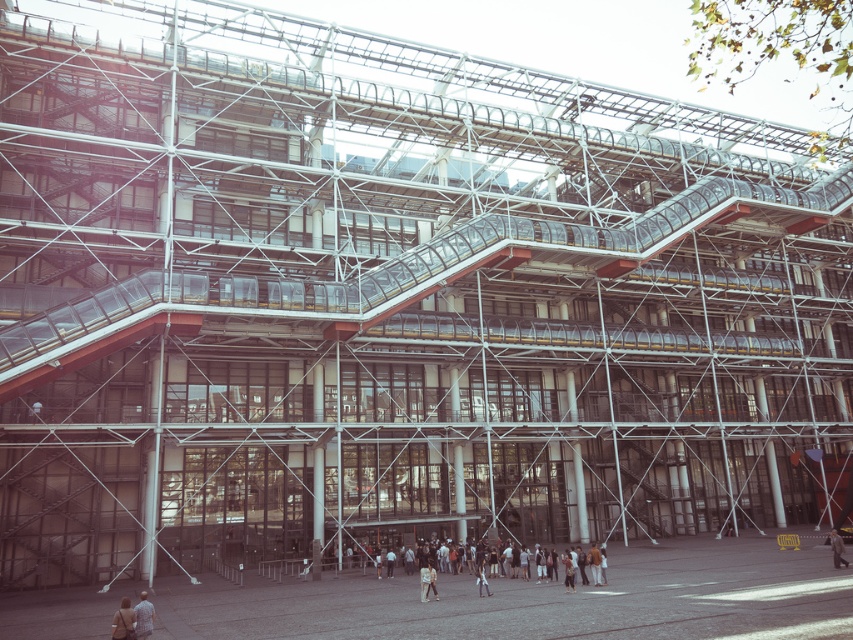
You are a security guard assigned to inspect the building. You notice a light brown leather jacket at lower center and light brown leather shoes at lower center. Which item is closer to the entrance of the building?

The light brown leather jacket at lower center is positioned over light brown leather shoes at lower center, meaning the jacket is closer to the entrance than the shoes.

You are standing at the entrance of the modern building and see the light brown leather jacket at lower center. If you walk straight ahead, will the jacket remain in your field of view?

The light brown leather jacket at lower center is located at point (427,580), which is near the lower part of the image. If you walk straight ahead, it might stay in your field of view depending on the building layout, but the exact visibility isn